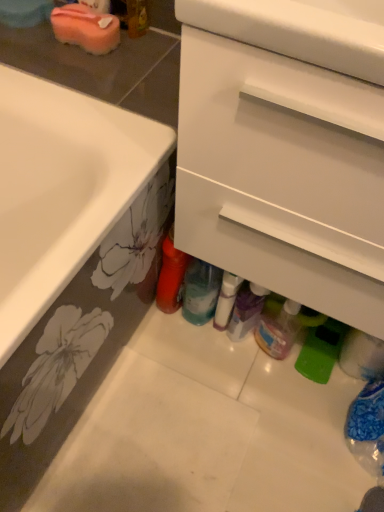
This screenshot has width=384, height=512. What do you see at coordinates (171, 276) in the screenshot?
I see `translucent plastic bottle at center, the first bottle positioned from the left` at bounding box center [171, 276].

This screenshot has height=512, width=384. Describe the element at coordinates (278, 330) in the screenshot. I see `translucent plastic bottle at lower center, which is counted as the first bottle, starting from the right` at that location.

Identify the location of translucent plastic bottle at lower center, which is counted as the first bottle, starting from the right. This screenshot has height=512, width=384. (278, 330).

In order to face translucent plastic bottles at lower center, should I rotate leftwards or rightwards?

Turn right by 7.507 degrees to look at translucent plastic bottles at lower center.

Describe the element at coordinates (201, 292) in the screenshot. Image resolution: width=384 pixels, height=512 pixels. I see `translucent plastic bottle at lower center, the third bottle when ordered from right to left` at that location.

This screenshot has height=512, width=384. What are the coordinates of `white matte drawer at center` in the screenshot? It's located at (283, 133).

Looking at this image, is translucent plastic bottle at center, which is the fourth bottle in right-to-left order, far away from white matte drawer at center?

No, translucent plastic bottle at center, which is the fourth bottle in right-to-left order, is not far away from white matte drawer at center.

Is translucent plastic bottle at center, the first bottle positioned from the left, to the left or to the right of white matte drawer at center in the image?

Clearly, translucent plastic bottle at center, the first bottle positioned from the left, is on the left of white matte drawer at center in the image.

Who is taller, translucent plastic bottle at center, which is the fourth bottle in right-to-left order, or white matte drawer at center?

With more height is white matte drawer at center.

Based on the photo, from the image's perspective, who appears lower, translucent plastic bottle at center, the first bottle positioned from the left, or white matte drawer at center?

From the image's view, translucent plastic bottle at center, the first bottle positioned from the left, is below.

Does point (229, 322) appear closer or farther from the camera than point (197, 291)?

Point (229, 322) is farther from the camera than point (197, 291).

Where is `toiletry that is under the translucent plastic bottle at lower center, the third bottle when ordered from right to left (from a real-world perspective)`? toiletry that is under the translucent plastic bottle at lower center, the third bottle when ordered from right to left (from a real-world perspective) is located at coordinates (246, 310).

Which object is thinner, translucent plastic bottles at lower center or translucent plastic bottle at lower center, the third bottle when ordered from right to left?

translucent plastic bottle at lower center, the third bottle when ordered from right to left.

Based on the photo, how far apart are translucent plastic bottles at lower center and translucent plastic bottle at lower center, the third bottle when ordered from right to left?

translucent plastic bottles at lower center and translucent plastic bottle at lower center, the third bottle when ordered from right to left, are 3.41 inches apart from each other.

Between white glossy bottle at center, which ranks as the 3th bottle in left-to-right order, and translucent plastic bottle at lower center, the third bottle when ordered from right to left, which one has more height?

translucent plastic bottle at lower center, the third bottle when ordered from right to left, is taller.

Where is `the 1st bottle in front when counting from the translucent plastic bottle at lower center, the third bottle when ordered from right to left`? The height and width of the screenshot is (512, 384). the 1st bottle in front when counting from the translucent plastic bottle at lower center, the third bottle when ordered from right to left is located at coordinates (226, 300).

From the image's perspective, between white glossy bottle at center, which ranks as the 3th bottle in left-to-right order, and translucent plastic bottle at lower center, positioned as the second bottle in left-to-right order, which one is located above?

translucent plastic bottle at lower center, positioned as the second bottle in left-to-right order, is shown above in the image.

Is white glossy bottle at center, which ranks as the 3th bottle in left-to-right order, with translucent plastic bottle at lower center, positioned as the second bottle in left-to-right order?

Yes, white glossy bottle at center, which ranks as the 3th bottle in left-to-right order, is right next to translucent plastic bottle at lower center, positioned as the second bottle in left-to-right order, and making contact.

Which object is thinner, white glossy bottle at center, which ranks as the 3th bottle in left-to-right order, or translucent plastic bottle at center, the first bottle positioned from the left?

With smaller width is white glossy bottle at center, which ranks as the 3th bottle in left-to-right order.

From the image's perspective, is white glossy bottle at center, which ranks as the 3th bottle in left-to-right order, over translucent plastic bottle at center, which is the fourth bottle in right-to-left order?

No, from the image's perspective, white glossy bottle at center, which ranks as the 3th bottle in left-to-right order, is not on top of translucent plastic bottle at center, which is the fourth bottle in right-to-left order.

Considering the positions of objects white glossy bottle at center, placed as the 2th bottle when sorted from right to left, and translucent plastic bottle at center, which is the fourth bottle in right-to-left order, in the image provided, who is more to the right, white glossy bottle at center, placed as the 2th bottle when sorted from right to left, or translucent plastic bottle at center, which is the fourth bottle in right-to-left order,?

white glossy bottle at center, placed as the 2th bottle when sorted from right to left, is more to the right.

Locate an element on the screen. the 1st bottle located beneath the pink sponge at upper left (from a real-world perspective) is located at coordinates (171, 276).

Is translucent plastic bottle at center, the first bottle positioned from the left, wider or thinner than pink sponge at upper left?

Clearly, translucent plastic bottle at center, the first bottle positioned from the left, has more width compared to pink sponge at upper left.

How distant is translucent plastic bottle at center, the first bottle positioned from the left, from pink sponge at upper left?

translucent plastic bottle at center, the first bottle positioned from the left, is 20.80 inches from pink sponge at upper left.

Which is in front, point (112, 19) or point (259, 320)?

The point (112, 19) is in front.

Can you confirm if pink sponge at upper left is thinner than translucent plastic bottle at lower center, acting as the 4th bottle starting from the left?

Incorrect, the width of pink sponge at upper left is not less than that of translucent plastic bottle at lower center, acting as the 4th bottle starting from the left.

Does pink sponge at upper left have a lesser height compared to translucent plastic bottle at lower center, acting as the 4th bottle starting from the left?

Indeed, pink sponge at upper left has a lesser height compared to translucent plastic bottle at lower center, acting as the 4th bottle starting from the left.

How far apart are pink sponge at upper left and translucent plastic bottle at lower center, acting as the 4th bottle starting from the left?

pink sponge at upper left is 31.77 inches from translucent plastic bottle at lower center, acting as the 4th bottle starting from the left.

Is white matte drawer at center placed right next to translucent plastic bottle at lower center, the third bottle when ordered from right to left?

No, white matte drawer at center is not making contact with translucent plastic bottle at lower center, the third bottle when ordered from right to left.

Is white matte drawer at center aimed at translucent plastic bottle at lower center, positioned as the second bottle in left-to-right order?

No, white matte drawer at center is not facing towards translucent plastic bottle at lower center, positioned as the second bottle in left-to-right order.

From the image's perspective, who appears lower, white matte drawer at center or translucent plastic bottle at lower center, the third bottle when ordered from right to left?

From the image's view, translucent plastic bottle at lower center, the third bottle when ordered from right to left, is below.

Is white matte drawer at center closer to camera compared to translucent plastic bottle at lower center, positioned as the second bottle in left-to-right order?

Yes, white matte drawer at center is closer to the camera.

Locate an element on the screen. The width and height of the screenshot is (384, 512). the 4th bottle counting from the left side of the white matte drawer at center is located at coordinates 171,276.

Which bottle is the 2nd one when counting from the back of the translucent plastic bottles at lower center? Please provide its 2D coordinates.

[(201, 292)]

Looking at the image, which one is located further to translucent plastic bottle at lower center, acting as the 4th bottle starting from the left, white matte drawer at center or translucent plastic bottle at center, the first bottle positioned from the left?

Based on the image, white matte drawer at center appears to be further to translucent plastic bottle at lower center, acting as the 4th bottle starting from the left.

From the image, which object appears to be farther from white matte drawer at center, white glossy bottle at center, placed as the 2th bottle when sorted from right to left, or translucent plastic bottle at center, the first bottle positioned from the left?

translucent plastic bottle at center, the first bottle positioned from the left.

Based on their spatial positions, is pink sponge at upper left or translucent plastic bottle at lower center, acting as the 4th bottle starting from the left, further from translucent plastic bottle at lower center, the third bottle when ordered from right to left?

Among the two, pink sponge at upper left is located further to translucent plastic bottle at lower center, the third bottle when ordered from right to left.

Looking at the image, which one is located further to pink sponge at upper left, translucent plastic bottles at lower center or white glossy bottle at center, which ranks as the 3th bottle in left-to-right order?

Among the two, translucent plastic bottles at lower center is located further to pink sponge at upper left.

Estimate the real-world distances between objects in this image. Which object is further from pink sponge at upper left, translucent plastic bottles at lower center or white matte drawer at center?

Based on the image, translucent plastic bottles at lower center appears to be further to pink sponge at upper left.

Considering their positions, is translucent plastic bottle at lower center, positioned as the second bottle in left-to-right order, positioned further to translucent plastic bottle at center, the first bottle positioned from the left, than white glossy bottle at center, which ranks as the 3th bottle in left-to-right order?

Based on the image, white glossy bottle at center, which ranks as the 3th bottle in left-to-right order, appears to be further to translucent plastic bottle at center, the first bottle positioned from the left.

Based on their spatial positions, is translucent plastic bottle at lower center, which is counted as the first bottle, starting from the right, or white glossy bottle at center, which ranks as the 3th bottle in left-to-right order, further from translucent plastic bottle at center, which is the fourth bottle in right-to-left order?

translucent plastic bottle at lower center, which is counted as the first bottle, starting from the right, is positioned further to the anchor translucent plastic bottle at center, which is the fourth bottle in right-to-left order.

Estimate the real-world distances between objects in this image. Which object is closer to white matte drawer at center, translucent plastic bottle at lower center, which is counted as the first bottle, starting from the right, or pink sponge at upper left?

Based on the image, pink sponge at upper left appears to be nearer to white matte drawer at center.

Image resolution: width=384 pixels, height=512 pixels. Find the location of `toiletry that lies between pink sponge at upper left and translucent plastic bottle at lower center, acting as the 4th bottle starting from the left, from top to bottom`. toiletry that lies between pink sponge at upper left and translucent plastic bottle at lower center, acting as the 4th bottle starting from the left, from top to bottom is located at coordinates (246, 310).

What are the coordinates of `soap between white matte drawer at center and translucent plastic bottle at lower center, positioned as the second bottle in left-to-right order, along the z-axis` in the screenshot? It's located at (86, 28).

The width and height of the screenshot is (384, 512). What are the coordinates of `bottle between white matte drawer at center and translucent plastic bottle at center, the first bottle positioned from the left, in the front-back direction` in the screenshot? It's located at (278, 330).

Locate an element on the screen. This screenshot has height=512, width=384. bottle between translucent plastic bottle at lower center, the third bottle when ordered from right to left, and translucent plastic bottle at lower center, acting as the 4th bottle starting from the left is located at coordinates (226, 300).